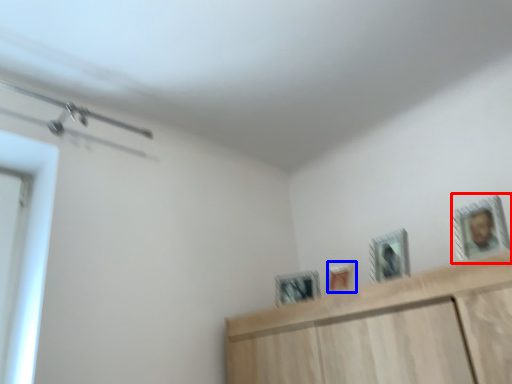
Question: Which of the following is the closest to the observer, picture frame (highlighted by a red box) or picture frame (highlighted by a blue box)?

Choices:
 (A) picture frame
 (B) picture frame

Answer: (A)